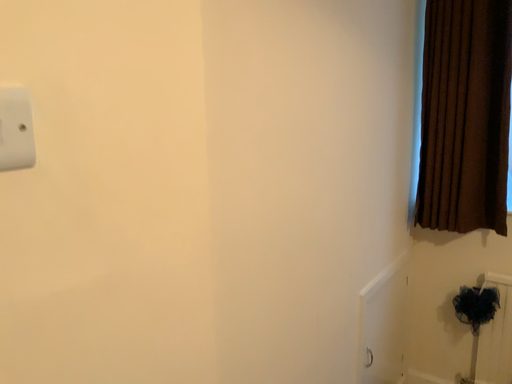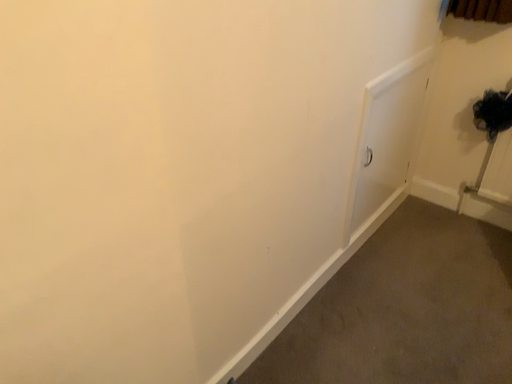
Question: How did the camera likely rotate when shooting the video?

Choices:
 (A) rotated downward
 (B) rotated upward

Answer: (A)